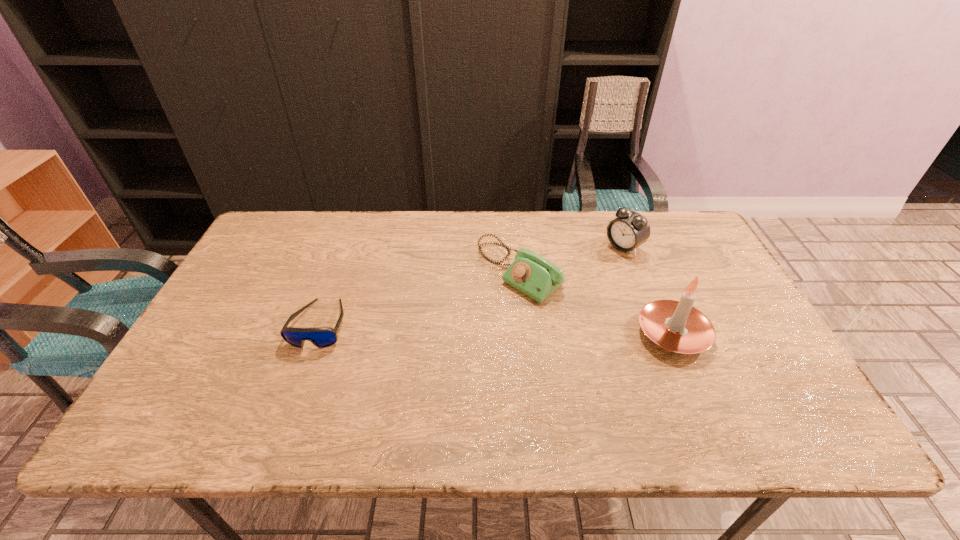
Where is `sunglasses`? The width and height of the screenshot is (960, 540). sunglasses is located at coordinates (321, 337).

The image size is (960, 540). I want to click on the shortest object, so tap(321, 337).

The image size is (960, 540). What are the coordinates of `the tallest object` in the screenshot? It's located at (677, 326).

Image resolution: width=960 pixels, height=540 pixels. Identify the location of alarm clock. [630, 229].

You are a GUI agent. You are given a task and a screenshot of the screen. Output one action in this format:
    pyautogui.click(x=<x>, y=<y>)
    Task: Click on the second shortest object
    This screenshot has height=540, width=960.
    Given the screenshot: What is the action you would take?
    pyautogui.click(x=530, y=273)

Where is `telephone`? telephone is located at coordinates (530, 273).

Identify the location of vacant space located 0.090m on the front-facing side of the sunglasses. (299, 383).

The width and height of the screenshot is (960, 540). Find the location of `vacant region located on the back of the tallest object`. vacant region located on the back of the tallest object is located at coordinates (637, 251).

I want to click on vacant space situated 0.210m on the front side of the second tallest object, so click(x=569, y=287).

Find the location of a particular element. This screenshot has height=540, width=960. free spot located on the front side of the second tallest object is located at coordinates (558, 295).